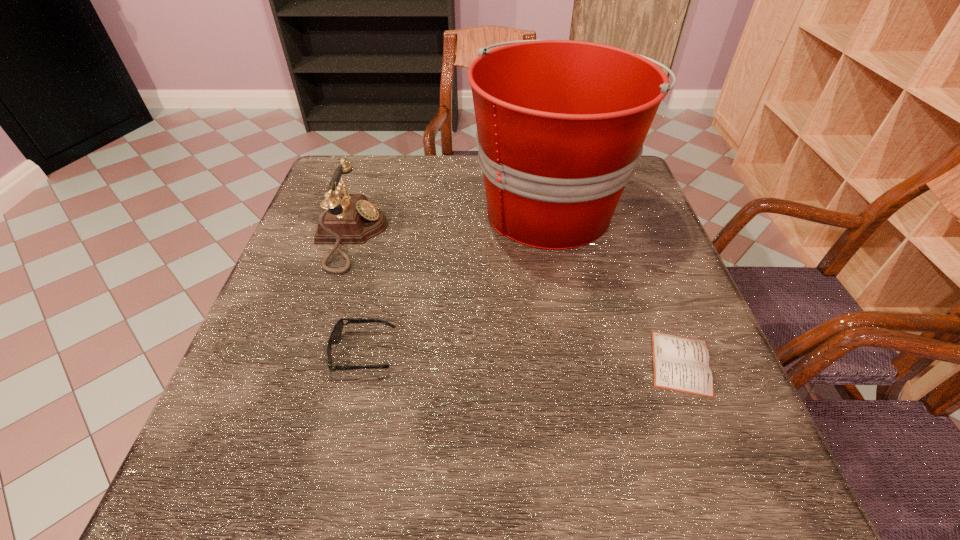
Identify the location of object that is the second closest to the second tallest object. (561, 124).

Identify which object is the second closest to the tallest object. Please provide its 2D coordinates. Your answer should be formatted as a tuple, i.e. [(x, y)], where the tuple contains the x and y coordinates of a point satisfying the conditions above.

[(347, 218)]

Identify the location of vacant space that satisfies the following two spatial constraints: 1. on the dial of the diary; 2. on the right side of the second tallest object. This screenshot has height=540, width=960. (310, 363).

This screenshot has width=960, height=540. I want to click on vacant space that satisfies the following two spatial constraints: 1. on the front-facing side of the diary; 2. on the left side of the second shortest object, so click(x=361, y=363).

I want to click on vacant area that satisfies the following two spatial constraints: 1. on the front side of the tallest object; 2. on the dial of the telephone, so click(557, 237).